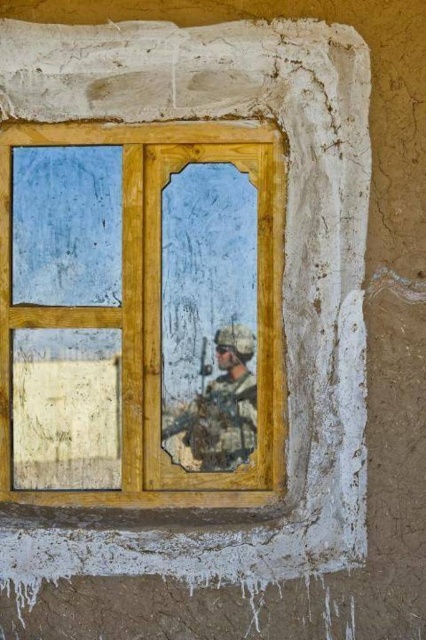
Question: Which of the following is the closest to the observer?

Choices:
 (A) wooden window frame at center
 (B) camouflage fabric soldier at center

Answer: (A)

Question: Can you confirm if wooden window frame at center is thinner than camouflage fabric soldier at center?

Choices:
 (A) yes
 (B) no

Answer: (B)

Question: Can you confirm if wooden window frame at center is thinner than camouflage fabric soldier at center?

Choices:
 (A) yes
 (B) no

Answer: (B)

Question: Which object is closer to the camera taking this photo?

Choices:
 (A) camouflage fabric soldier at center
 (B) wooden window frame at center

Answer: (B)

Question: Which of the following is the closest to the observer?

Choices:
 (A) [255, 387]
 (B) [242, 196]

Answer: (A)

Question: Can you confirm if wooden window frame at center is positioned above camouflage fabric soldier at center?

Choices:
 (A) no
 (B) yes

Answer: (B)